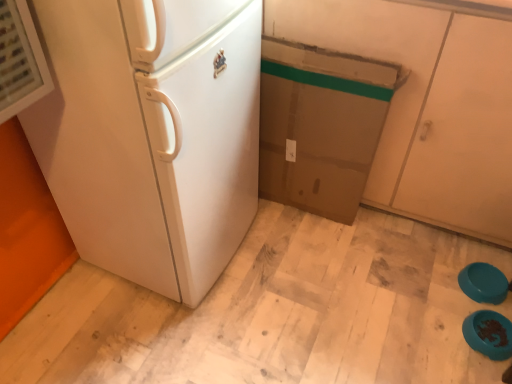
You are a GUI agent. You are given a task and a screenshot of the screen. Output one action in this format:
    pyautogui.click(x=<x>, y=<y>)
    Task: Click on the vacant space in teal plastic bowls at lower right, the 2th appliance viewed from the front (from a real-world perspective)
    This screenshot has width=512, height=384.
    Given the screenshot: What is the action you would take?
    pyautogui.click(x=481, y=284)